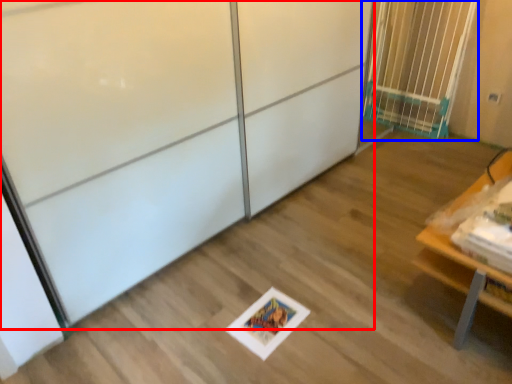
Question: Which object appears farthest to the camera in this image, screen door (highlighted by a red box) or elevator (highlighted by a blue box)?

Choices:
 (A) screen door
 (B) elevator

Answer: (B)